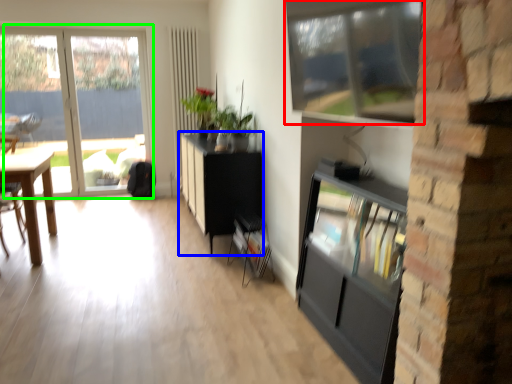
Question: Considering the real-world distances, which object is farthest from window (highlighted by a red box)? cabinetry (highlighted by a blue box) or window (highlighted by a green box)?

Choices:
 (A) cabinetry
 (B) window

Answer: (B)